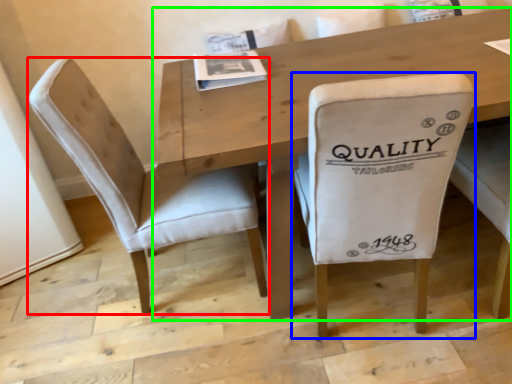
Question: Considering the real-world distances, which object is closest to chair (highlighted by a red box)? chair (highlighted by a blue box) or table (highlighted by a green box).

Choices:
 (A) chair
 (B) table

Answer: (B)